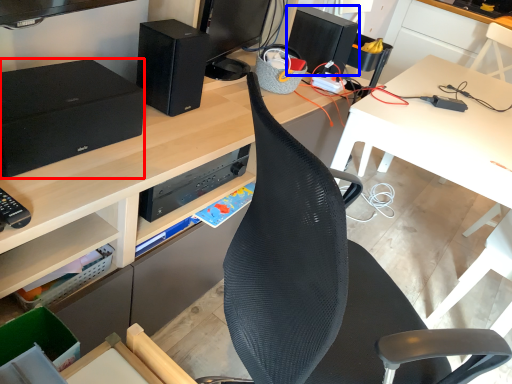
Question: Which of the following is the closest to the observer, speaker (highlighted by a red box) or speaker (highlighted by a blue box)?

Choices:
 (A) speaker
 (B) speaker

Answer: (A)